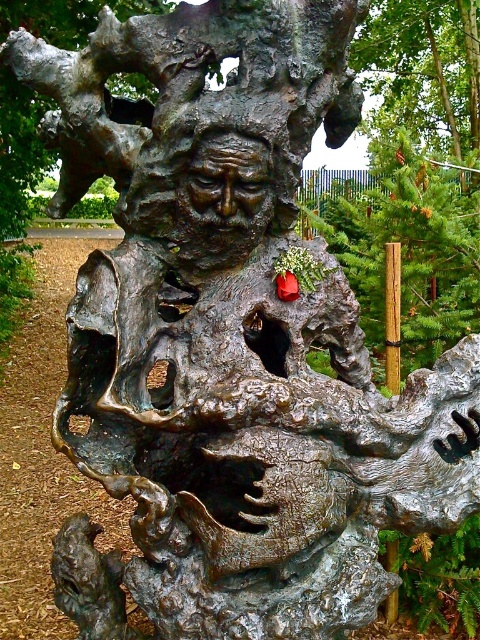
You are an artist planning to paint a landscape that includes the green textured pine tree at upper center and the bronze textured face at center. Based on their heights, which object should you place higher in your painting to maintain accuracy?

→ The green textured pine tree at upper center should be placed higher in the painting since it has a greater height compared to the bronze textured face at center.

You are an art student analyzing the sculpture and the surrounding environment. From your vantage point, which object is closer to you between the green textured pine tree at upper center and the bronze textured face at center?

The green textured pine tree at upper center is closer to you than the bronze textured face at center.

You are standing in front of the sculpture and notice a point marked at coordinates (423,72). Which object from the scene does this point belong to?

The point at coordinates (423,72) is on the green textured pine tree at upper center.